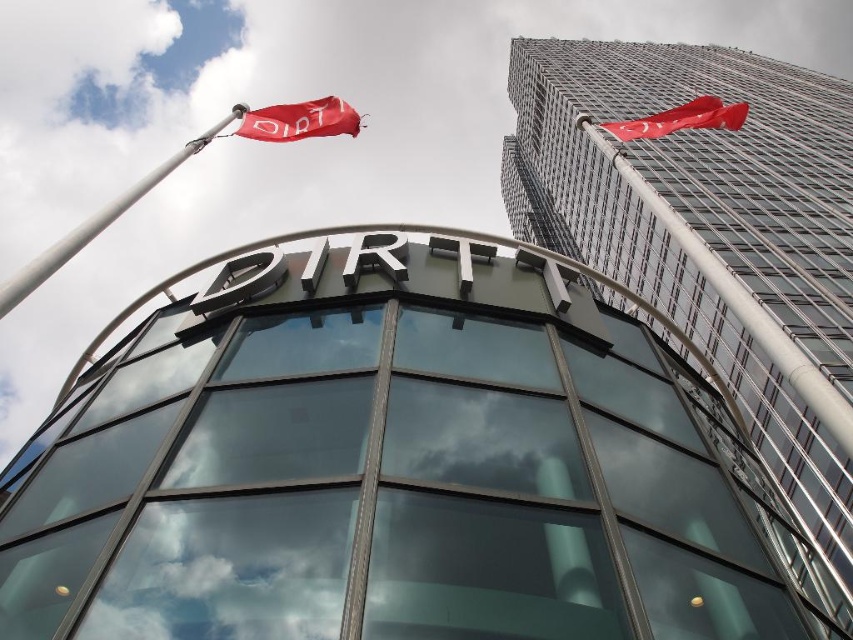
You are standing in front of the glass facade building and notice the silver metallic flag pole at upper left and the red fabric flag at upper left. Which object is positioned closer to you?

The silver metallic flag pole at upper left is closer to the viewer than the red fabric flag at upper left.

Consider the image. You are an architect inspecting the building facade. You notice the silver metallic flag pole at upper left and the red fabric flag at upper left. Which object is taller?

The silver metallic flag pole at upper left is taller than the red fabric flag at upper left.

You are standing in front of the glass facade building and want to determine the relative positions of the silver metallic flag pole at upper left and the red fabric flag at upper right. Based on the scene, which object is located below the other?

The silver metallic flag pole at upper left is positioned under red fabric flag at upper right, meaning the flag pole is below the flag.